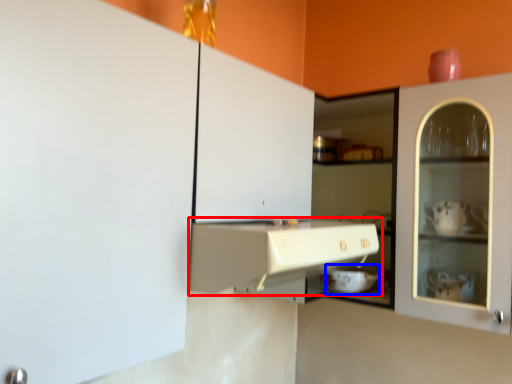
Question: Which point is closer to the camera, cabinetry (highlighted by a red box) or appliance (highlighted by a blue box)?

Choices:
 (A) cabinetry
 (B) appliance

Answer: (A)